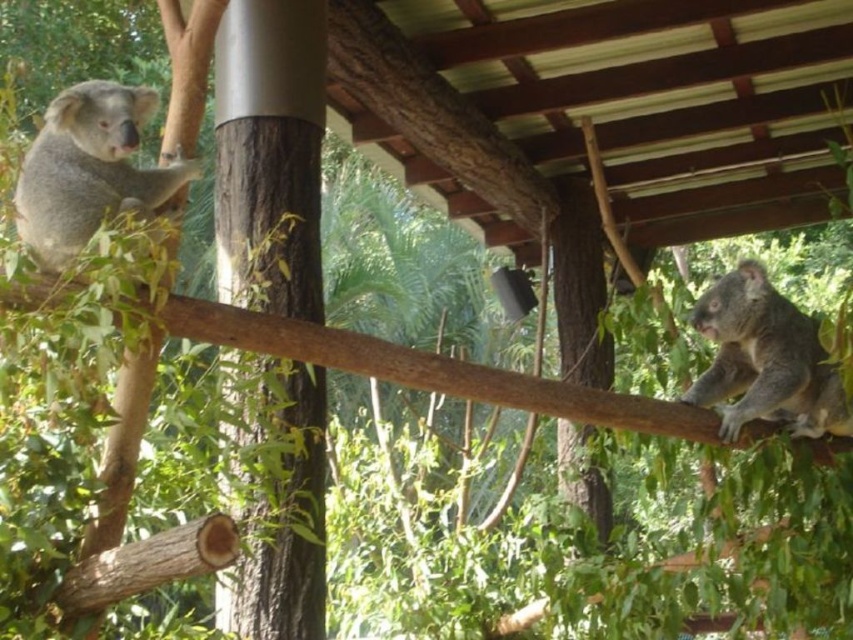
Question: Which point is closer to the camera?

Choices:
 (A) (784, 342)
 (B) (111, 120)

Answer: (B)

Question: Does gray furry koala at upper left appear on the left side of fuzzy gray koala at right?

Choices:
 (A) no
 (B) yes

Answer: (B)

Question: Among these points, which one is nearest to the camera?

Choices:
 (A) (129, 170)
 (B) (729, 337)

Answer: (A)

Question: In this image, where is gray furry koala at upper left located relative to fuzzy gray koala at right?

Choices:
 (A) below
 (B) above

Answer: (B)

Question: Can you confirm if gray furry koala at upper left is positioned to the right of fuzzy gray koala at right?

Choices:
 (A) no
 (B) yes

Answer: (A)

Question: Which of the following is the farthest from the observer?

Choices:
 (A) (80, 216)
 (B) (840, 412)

Answer: (B)